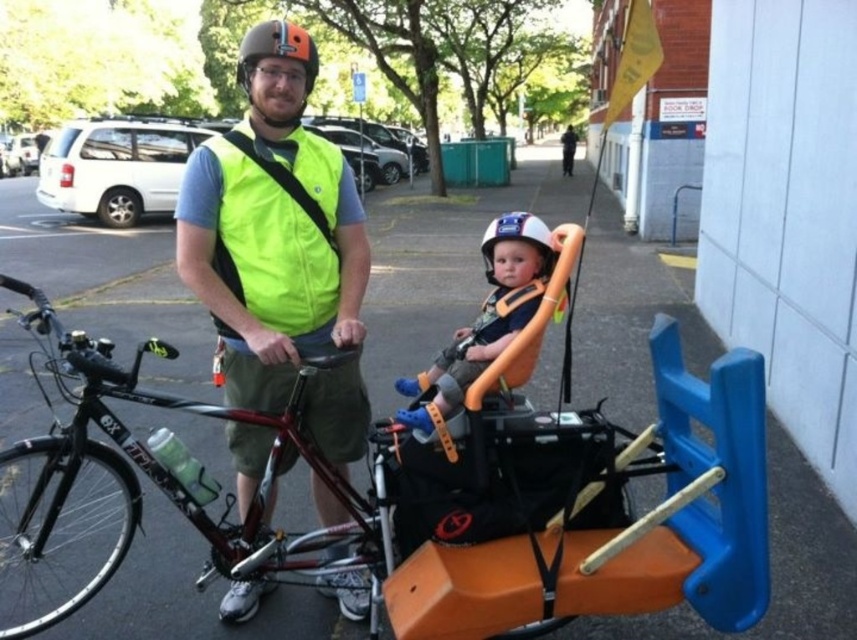
Question: Which of the following is the farthest from the observer?

Choices:
 (A) (571, 490)
 (B) (324, 285)
 (C) (243, 38)

Answer: (C)

Question: Which object is the farthest from the white matte helmet at center?

Choices:
 (A) neon yellow fabric safety vest at center
 (B) neon yellow vest at center
 (C) orange plastic baby carriage at center
 (D) matte orange helmet at center

Answer: (D)

Question: Estimate the real-world distances between objects in this image. Which object is closer to the matte orange helmet at center?

Choices:
 (A) white matte helmet at center
 (B) neon yellow vest at center

Answer: (B)

Question: In this image, where is orange plastic baby carriage at center located relative to shiny black frame at center?

Choices:
 (A) right
 (B) left

Answer: (A)

Question: Does neon yellow vest at center have a smaller size compared to neon yellow fabric safety vest at center?

Choices:
 (A) yes
 (B) no

Answer: (B)

Question: From the image, what is the correct spatial relationship of orange plastic baby carriage at center in relation to neon yellow fabric safety vest at center?

Choices:
 (A) right
 (B) left

Answer: (A)